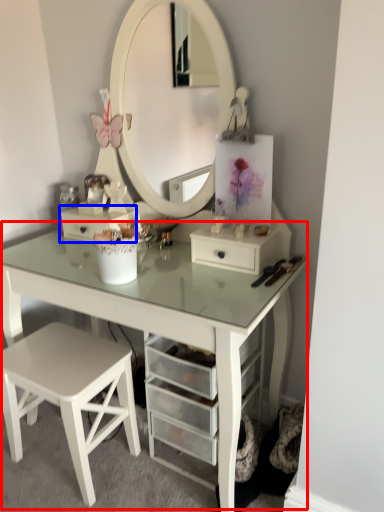
Question: Which object is further to the camera taking this photo, table (highlighted by a red box) or drawer (highlighted by a blue box)?

Choices:
 (A) table
 (B) drawer

Answer: (B)